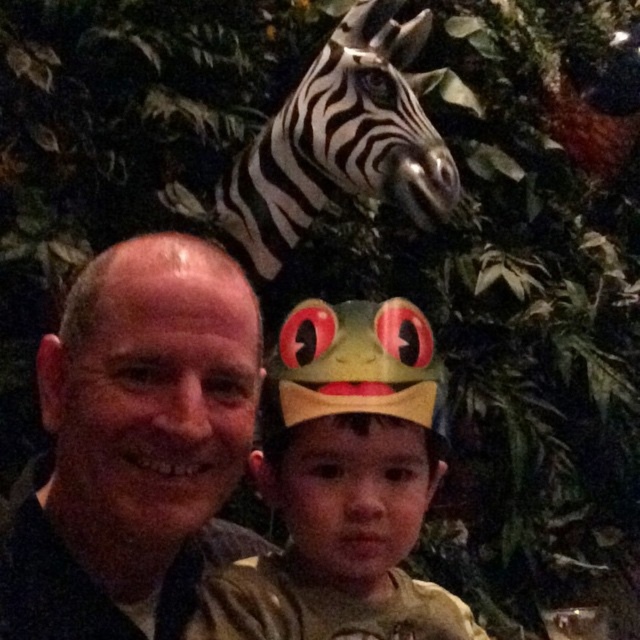
From the picture: Can you confirm if matte black head at left is bigger than black and white striped zebra head at upper center?

Actually, matte black head at left might be smaller than black and white striped zebra head at upper center.

Between point (65, 476) and point (220, 184), which one is positioned behind?

Point (220, 184)

Is point (106, 362) positioned before point (372, 140)?

Yes, point (106, 362) is closer to viewer.

This screenshot has height=640, width=640. In order to click on matte black head at left in this screenshot , I will do `click(150, 392)`.

Does matte green paper crown at center have a larger size compared to black and white striped zebra head at upper center?

Incorrect, matte green paper crown at center is not larger than black and white striped zebra head at upper center.

Between point (372, 324) and point (307, 182), which one is positioned behind?

Point (307, 182)

Where is `matte green paper crown at center`? matte green paper crown at center is located at coordinates (346, 486).

Which is above, matte green paper crown at center or matte black head at left?

matte black head at left is above.

Who is taller, matte green paper crown at center or matte black head at left?

matte green paper crown at center is taller.

The image size is (640, 640). Find the location of `matte green paper crown at center`. matte green paper crown at center is located at coordinates (346, 486).